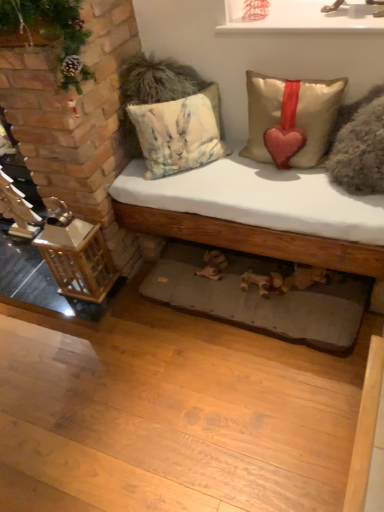
The height and width of the screenshot is (512, 384). Find the location of `vacant space positioned to the left of satin beige cushion at right, which is the third pillow from left to right`. vacant space positioned to the left of satin beige cushion at right, which is the third pillow from left to right is located at coordinates (284, 197).